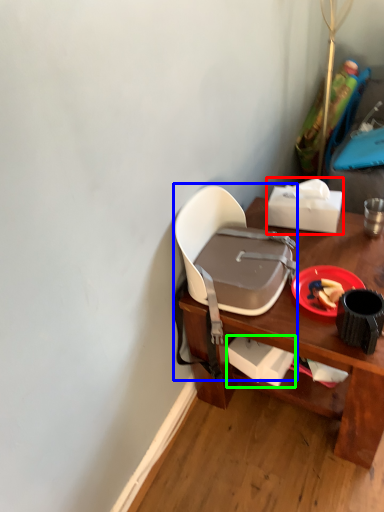
Question: Considering the real-world distances, which object is farthest from box (highlighted by a red box)? chair (highlighted by a blue box) or box (highlighted by a green box)?

Choices:
 (A) chair
 (B) box

Answer: (B)